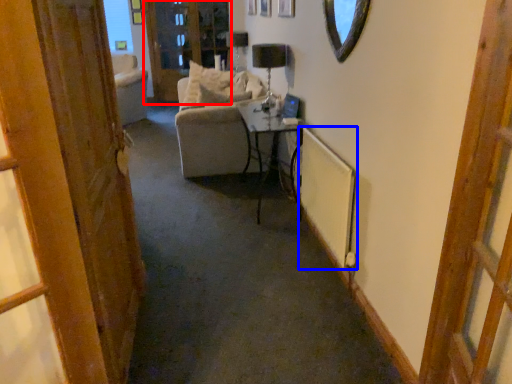
Question: Which object is closer to the camera taking this photo, screen door (highlighted by a red box) or radiator (highlighted by a blue box)?

Choices:
 (A) screen door
 (B) radiator

Answer: (B)